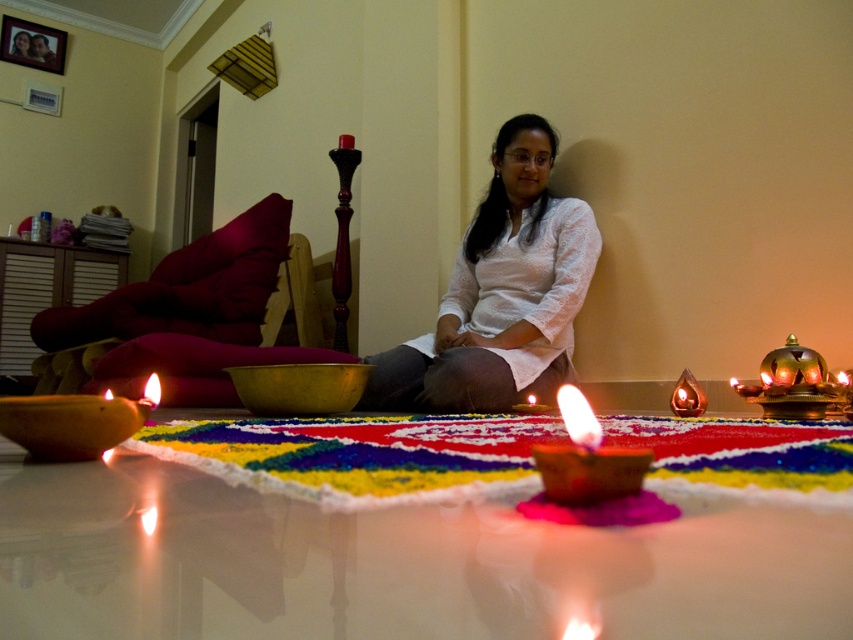
The image size is (853, 640). What do you see at coordinates (500, 292) in the screenshot?
I see `white textured shirt at center` at bounding box center [500, 292].

Identify the location of white textured shirt at center. (500, 292).

Can you confirm if white textured shirt at center is positioned below metallic gold lampshade at upper center?

Yes.

Between point (488, 236) and point (245, 92), which one is positioned behind?

Positioned behind is point (245, 92).

Locate an element on the screen. The width and height of the screenshot is (853, 640). white textured shirt at center is located at coordinates (500, 292).

Does matte brown candle at lower center appear over matte gold candle at center?

Yes.

Describe the element at coordinates (585, 458) in the screenshot. I see `matte brown candle at lower center` at that location.

This screenshot has width=853, height=640. Identify the location of matte brown candle at lower center. (585, 458).

The image size is (853, 640). Identify the location of matte brown candle at lower center. (585, 458).